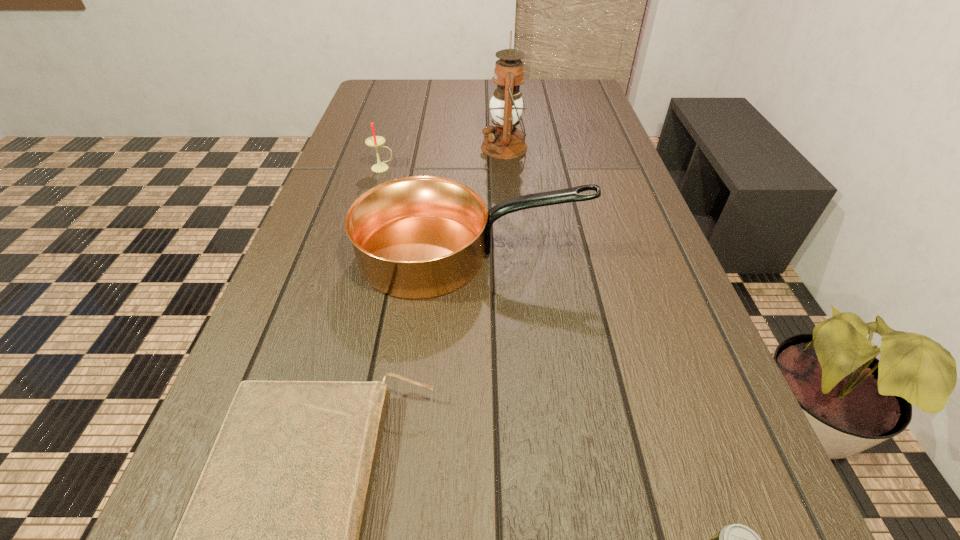
The image size is (960, 540). I want to click on the tallest object, so click(504, 141).

This screenshot has width=960, height=540. In order to click on the second tallest object in this screenshot , I will do `click(418, 237)`.

Locate an element on the screen. the third nearest object is located at coordinates (418, 237).

Image resolution: width=960 pixels, height=540 pixels. In order to click on candle in this screenshot , I will do `click(375, 141)`.

The height and width of the screenshot is (540, 960). What are the coordinates of `vacant space located 0.050m on the side of the lantern, there is a wick adjustment knob` in the screenshot? It's located at (463, 147).

This screenshot has width=960, height=540. I want to click on vacant space situated 0.330m on the side of the lantern, there is a wick adjustment knob, so coord(363,147).

At what (x,y) coordinates should I click in order to perform the action: click on free space located on the side of the lantern, there is a wick adjustment knob. Please return your answer as a coordinate pair (x, y). Looking at the image, I should click on pyautogui.click(x=395, y=147).

You are a GUI agent. You are given a task and a screenshot of the screen. Output one action in this format:
    pyautogui.click(x=<x>, y=<y>)
    Task: Click on the free space located on the handle side of the frying pan
    
    Given the screenshot: What is the action you would take?
    pyautogui.click(x=649, y=254)

Where is `vacant space located 0.110m on the front of the candle`? This screenshot has width=960, height=540. vacant space located 0.110m on the front of the candle is located at coordinates (373, 198).

At what (x,y) coordinates should I click in order to perform the action: click on frying pan that is positioned at the left edge. Please return your answer as a coordinate pair (x, y). The width and height of the screenshot is (960, 540). Looking at the image, I should click on (418, 237).